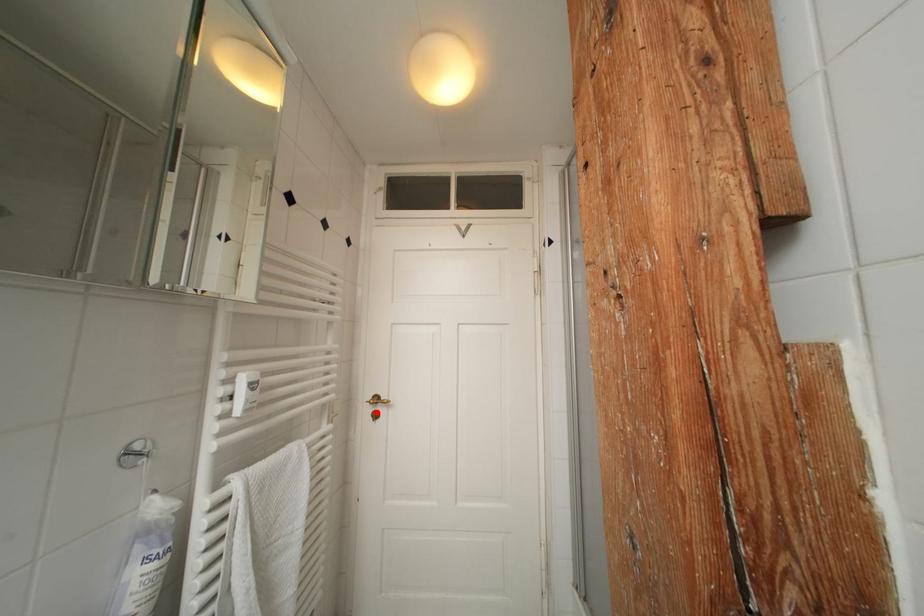
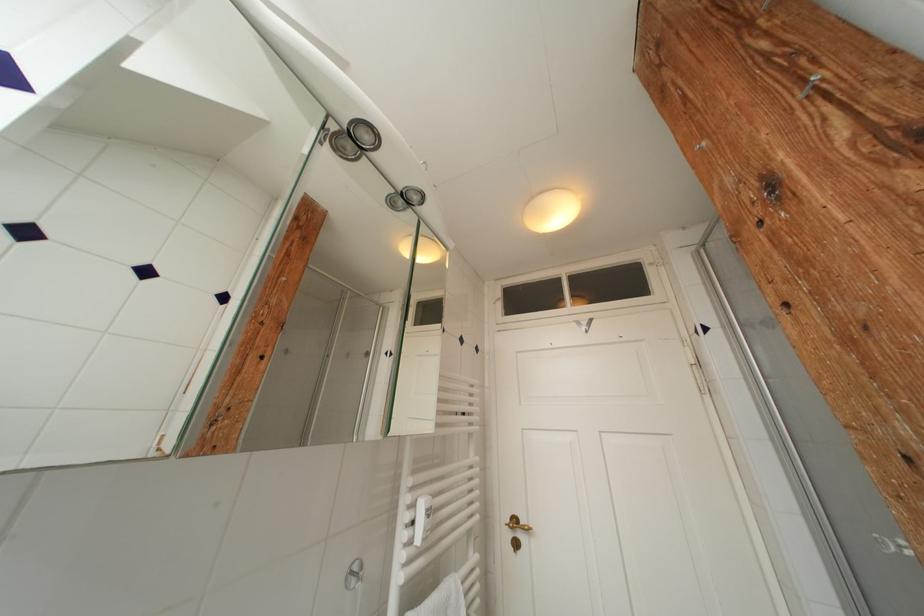
Find the pixel in the second image that matches the highlighted location in the first image.

(516, 539)